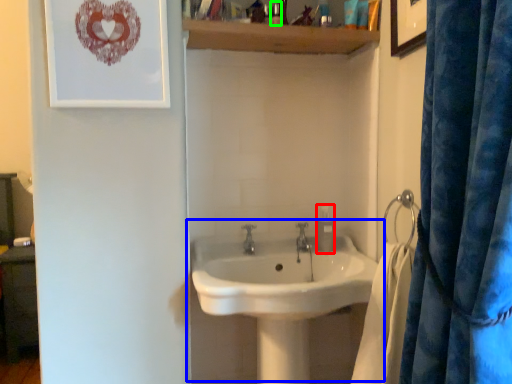
Question: Estimate the real-world distances between objects in this image. Which object is closer to soap dispenser (highlighted by a red box), sink (highlighted by a blue box) or toiletry (highlighted by a green box)?

Choices:
 (A) sink
 (B) toiletry

Answer: (A)